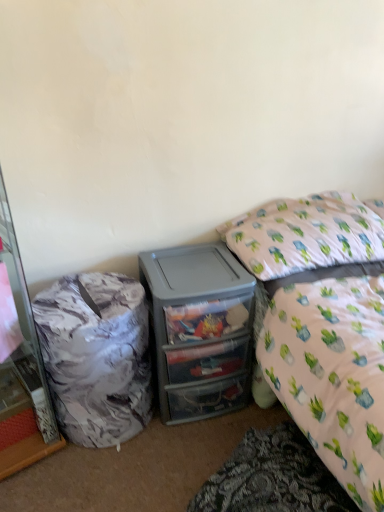
Identify the location of vacant space that is in between marble-patterned cabinet at left and marble-patterned trash can at left. The height and width of the screenshot is (512, 384). (73, 463).